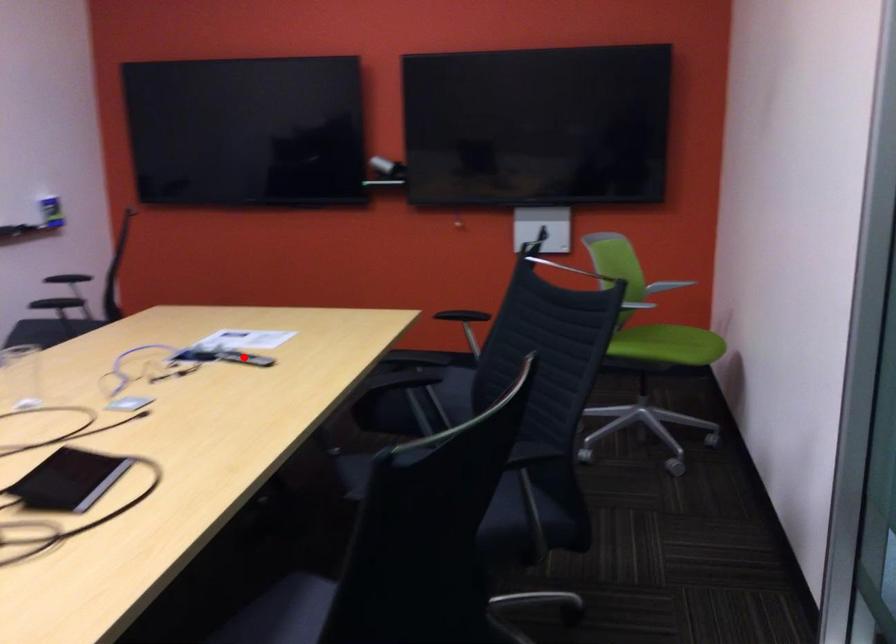
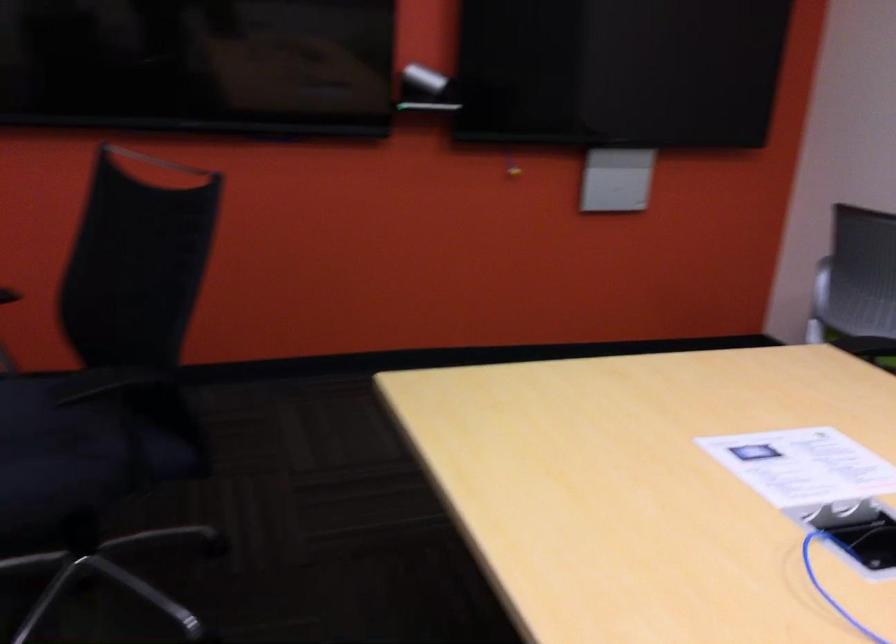
In the second image, find the point that corresponds to the highlighted location in the first image.

(858, 532)